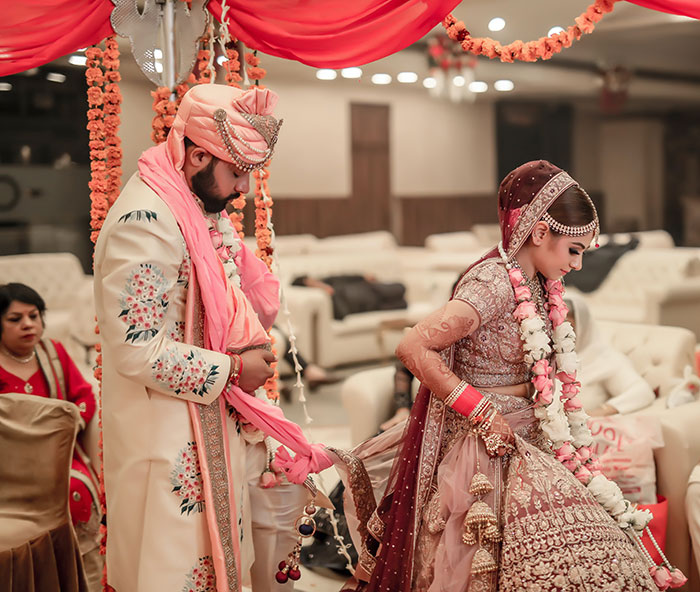
This screenshot has height=592, width=700. I want to click on sleeping person on couch, so click(355, 289).